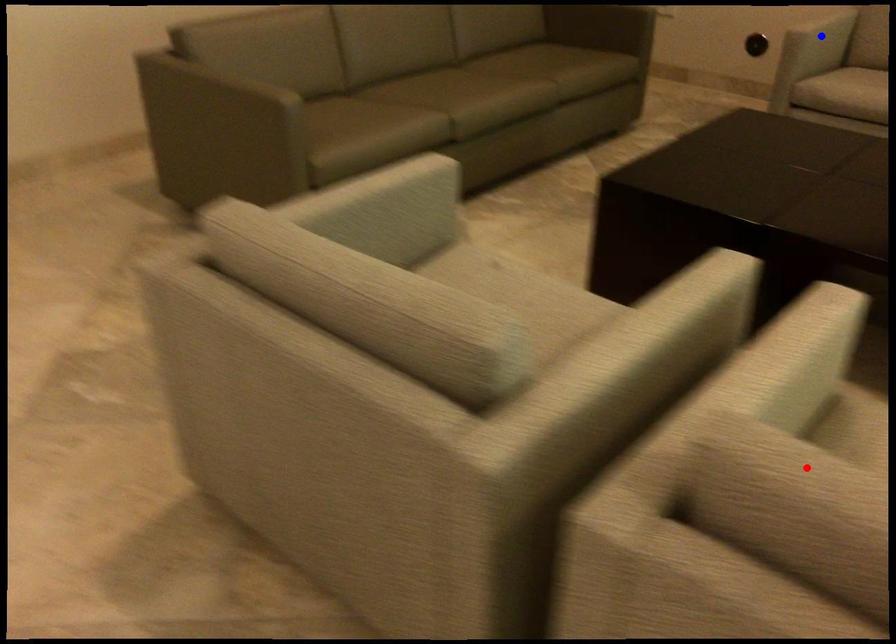
Question: In the image, two points are highlighted. Which point is nearer to the camera? Reply with the corresponding letter.

Choices:
 (A) blue point
 (B) red point

Answer: (B)